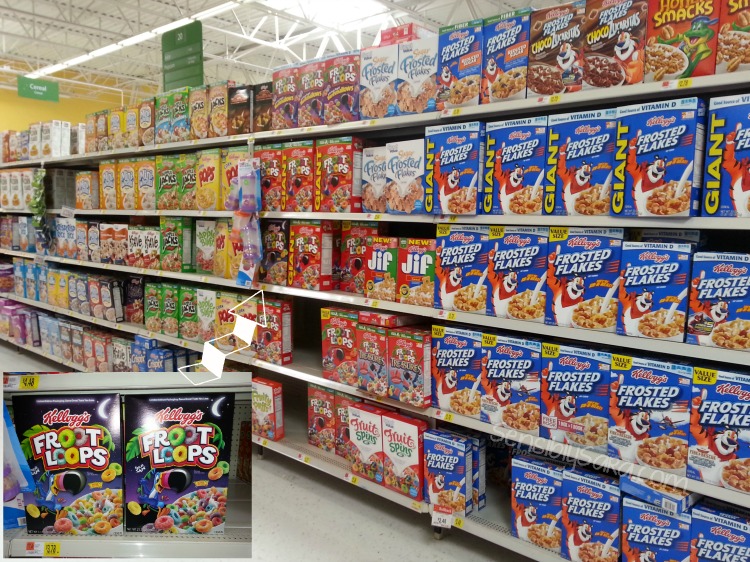
Image resolution: width=750 pixels, height=562 pixels. I want to click on store shelves, so click(288, 452), click(291, 374), click(315, 294), click(324, 222), click(328, 131).